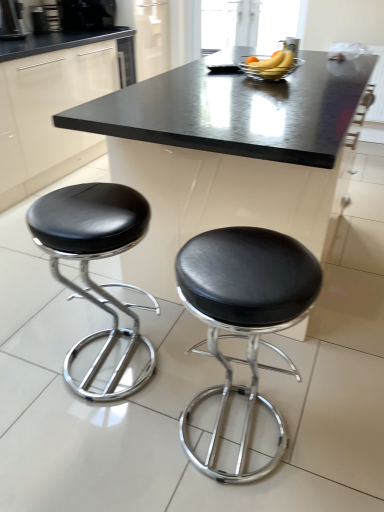
Where is `empty space that is ontop of black leather stool at lower right, marked as the 2th stool in a left-to-right arrangement (from a real-world perspective)`? empty space that is ontop of black leather stool at lower right, marked as the 2th stool in a left-to-right arrangement (from a real-world perspective) is located at coordinates (251, 270).